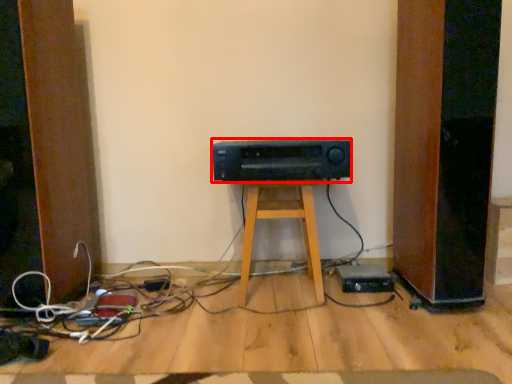
Question: Observing the image, what is the correct spatial positioning of amplifier (annotated by the red box) in reference to furniture?

Choices:
 (A) left
 (B) right

Answer: (B)